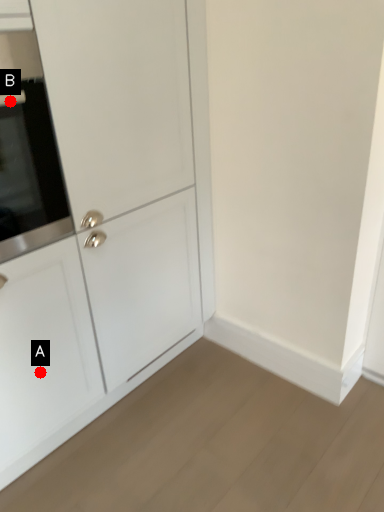
Question: Two points are circled on the image, labeled by A and B beside each circle. Which point is farther from the camera taking this photo?

Choices:
 (A) A is further
 (B) B is further

Answer: (A)